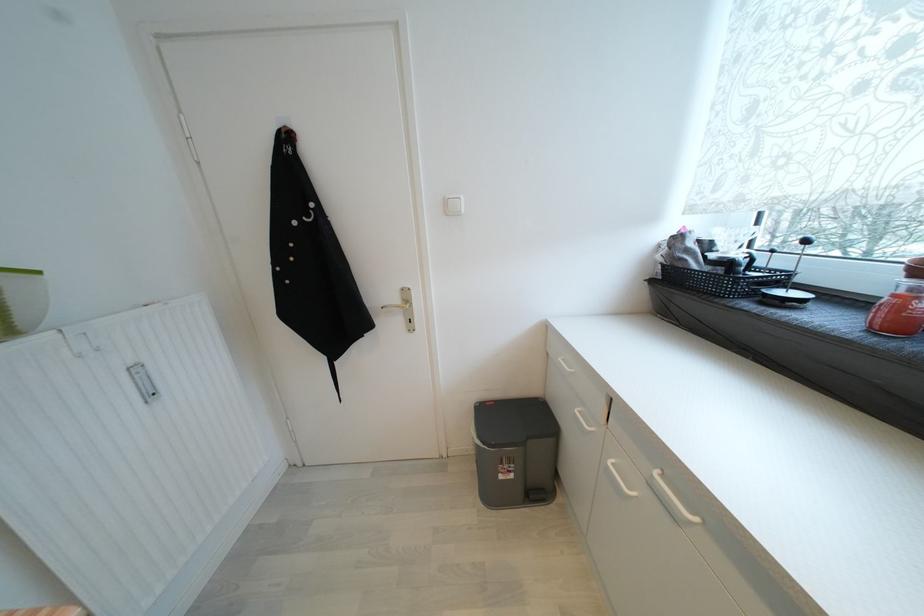
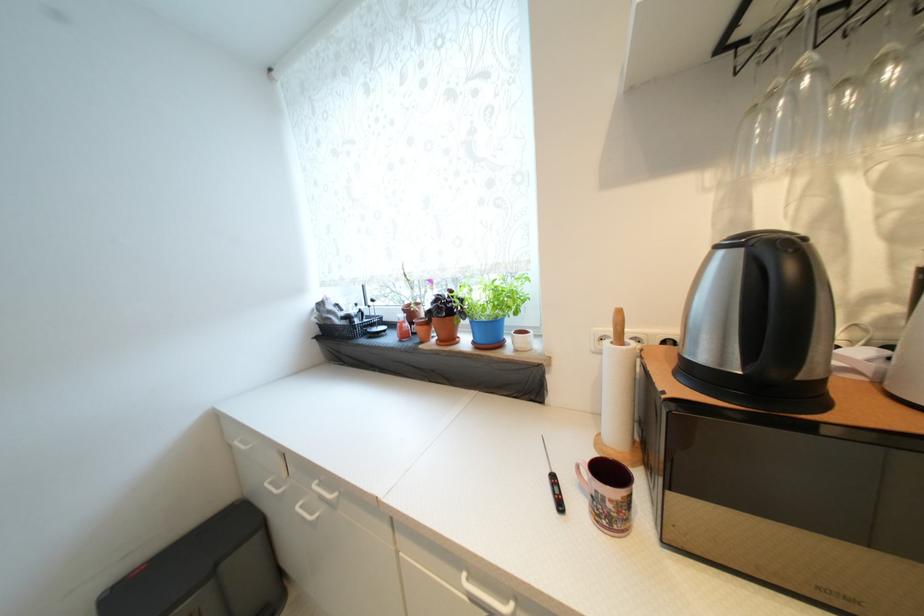
The point at (555, 443) is marked in the first image. Where is the corresponding point in the second image?

(261, 541)